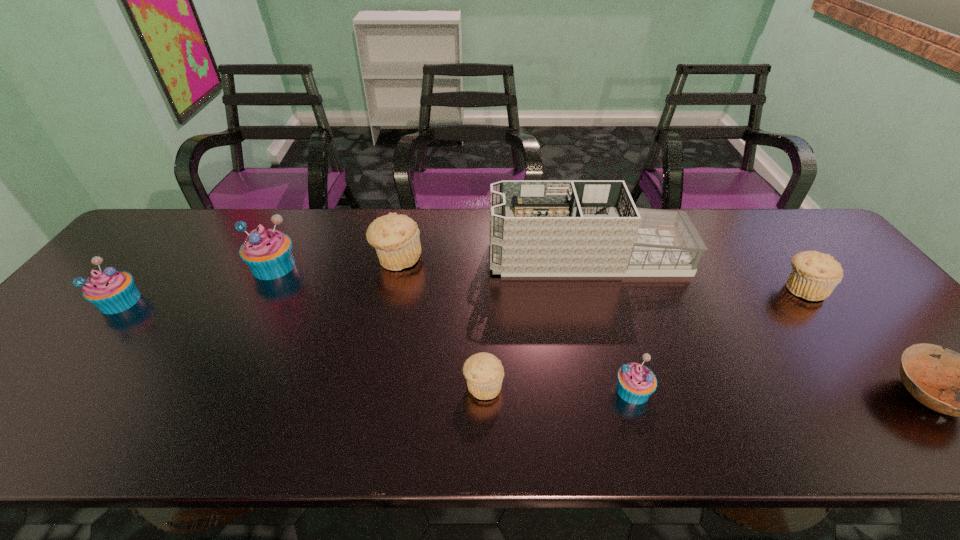
Find the location of `muffin that is the fourth closest to the biggest beige muffin`. muffin that is the fourth closest to the biggest beige muffin is located at coordinates (111, 291).

Identify the location of blue muffin that is the second nearest to the biggest beige muffin. (635, 384).

Locate an element on the screen. The width and height of the screenshot is (960, 540). the closest blue muffin to the leftmost muffin is located at coordinates pyautogui.click(x=268, y=253).

At what (x,y) coordinates should I click in order to perform the action: click on beige muffin that stands as the second closest to the rightmost muffin. Please return your answer as a coordinate pair (x, y). Looking at the image, I should click on (396, 238).

Locate which beige muffin is the second closest to the tallest object. Please provide its 2D coordinates. Your answer should be formatted as a tuple, i.e. [(x, y)], where the tuple contains the x and y coordinates of a point satisfying the conditions above.

[(814, 275)]

Locate an element on the screen. vacant area that satisfies the following two spatial constraints: 1. on the front side of the rightmost blue muffin; 2. on the right side of the biggest blue muffin is located at coordinates (210, 390).

Find the location of a particular element. This screenshot has width=960, height=540. vacant space that satisfies the following two spatial constraints: 1. on the back side of the farthest blue muffin; 2. on the right side of the fourth muffin from right to left is located at coordinates (277, 259).

The image size is (960, 540). I want to click on vacant region that satisfies the following two spatial constraints: 1. on the back side of the second muffin from left to right; 2. on the right side of the biggest beige muffin, so click(x=277, y=259).

The image size is (960, 540). I want to click on vacant area that satisfies the following two spatial constraints: 1. at the entrance of the tallest object; 2. on the back side of the rightmost muffin, so click(596, 289).

Identify the location of vacant position in the image that satisfies the following two spatial constraints: 1. at the entrance of the tallest object; 2. on the front side of the leftmost object. This screenshot has height=540, width=960. (600, 301).